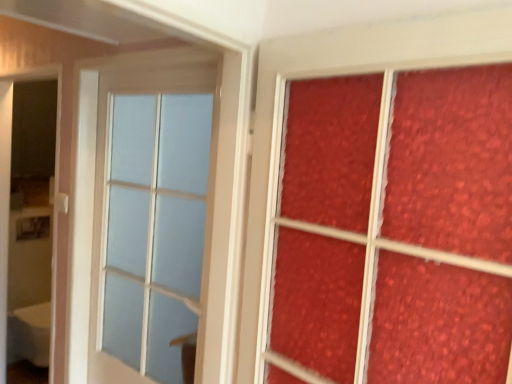
Question: From the image's perspective, is matte glass window at center on top of white glossy screen door at left?

Choices:
 (A) no
 (B) yes

Answer: (B)

Question: Is white glossy screen door at left at the back of matte glass window at center?

Choices:
 (A) yes
 (B) no

Answer: (B)

Question: Can we say matte glass window at center lies outside white glossy screen door at left?

Choices:
 (A) no
 (B) yes

Answer: (B)

Question: Is matte glass window at center taller than white glossy screen door at left?

Choices:
 (A) yes
 (B) no

Answer: (B)

Question: Does matte glass window at center have a smaller size compared to white glossy screen door at left?

Choices:
 (A) yes
 (B) no

Answer: (A)

Question: Considering the positions of white plastic door handle at upper left and white glossy screen door at left in the image, is white plastic door handle at upper left wider or thinner than white glossy screen door at left?

Choices:
 (A) wide
 (B) thin

Answer: (B)

Question: Visually, is white plastic door handle at upper left positioned to the left or to the right of white glossy screen door at left?

Choices:
 (A) left
 (B) right

Answer: (B)

Question: From their relative heights in the image, would you say white plastic door handle at upper left is taller or shorter than white glossy screen door at left?

Choices:
 (A) tall
 (B) short

Answer: (B)

Question: From the image's perspective, is white plastic door handle at upper left located above or below white glossy screen door at left?

Choices:
 (A) below
 (B) above

Answer: (B)

Question: Is white glossy screen door at left wider or thinner than matte glass window at center?

Choices:
 (A) wide
 (B) thin

Answer: (A)

Question: Is white glossy screen door at left inside the boundaries of matte glass window at center, or outside?

Choices:
 (A) inside
 (B) outside

Answer: (B)

Question: From a real-world perspective, is white glossy screen door at left physically located above or below matte glass window at center?

Choices:
 (A) below
 (B) above

Answer: (A)

Question: From their relative heights in the image, would you say white glossy screen door at left is taller or shorter than matte glass window at center?

Choices:
 (A) short
 (B) tall

Answer: (B)

Question: From the image's perspective, is white glossy screen door at left above or below matte textured glass at right?

Choices:
 (A) above
 (B) below

Answer: (B)

Question: Looking at the image, does white glossy screen door at left seem bigger or smaller compared to matte textured glass at right?

Choices:
 (A) small
 (B) big

Answer: (B)